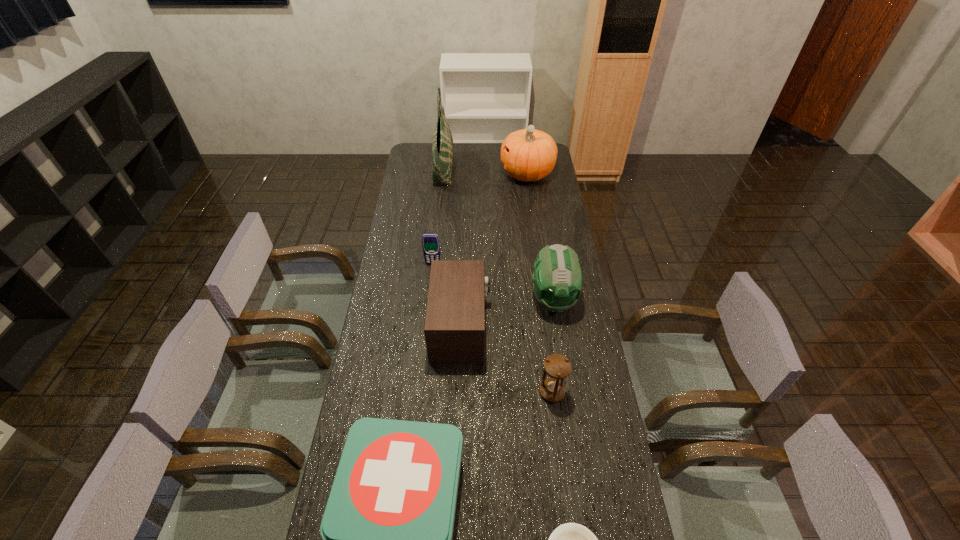
This screenshot has width=960, height=540. I want to click on vacant space located on the visor of the sixth shortest object, so click(564, 363).

Identify the location of free space located 0.060m on the front-facing side of the radio receiver. This screenshot has width=960, height=540. (507, 327).

Image resolution: width=960 pixels, height=540 pixels. What are the coordinates of `vacant region located on the left of the third nearest object` in the screenshot? It's located at (473, 392).

You are a GUI agent. You are given a task and a screenshot of the screen. Output one action in this format:
    pyautogui.click(x=<x>, y=<y>)
    Task: Click on the vacant space located on the front-facing side of the sixth nearest object
    The width and height of the screenshot is (960, 540).
    Given the screenshot: What is the action you would take?
    pyautogui.click(x=429, y=298)

Identify the location of tote bag that is at the far edge. This screenshot has height=540, width=960. (442, 143).

The height and width of the screenshot is (540, 960). In order to click on pumpkin present at the far edge in this screenshot , I will do `click(528, 155)`.

The image size is (960, 540). I want to click on tote bag positioned at the left edge, so click(x=442, y=143).

The image size is (960, 540). Identify the location of cellular telephone that is at the left edge. (431, 247).

Find the location of a particular element. The width and height of the screenshot is (960, 540). pumpkin present at the right edge is located at coordinates pyautogui.click(x=528, y=155).

You are a GUI agent. You are given a task and a screenshot of the screen. Output one action in this format:
    pyautogui.click(x=<x>, y=<y>)
    Task: Click on the football helmet that is at the right edge
    The height and width of the screenshot is (540, 960).
    Given the screenshot: What is the action you would take?
    pyautogui.click(x=557, y=279)